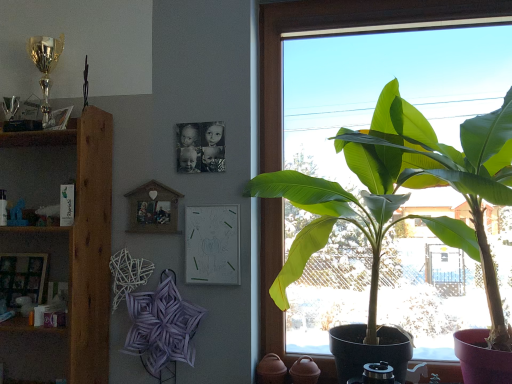
Question: From the image's perspective, is green leafy plant at right under wooden picture frame at lower left, acting as the first picture frame starting from the left?

Choices:
 (A) no
 (B) yes

Answer: (A)

Question: Does green leafy plant at right have a lesser width compared to wooden picture frame at lower left, acting as the first picture frame starting from the left?

Choices:
 (A) no
 (B) yes

Answer: (A)

Question: Can you confirm if green leafy plant at right is shorter than wooden picture frame at lower left, acting as the first picture frame starting from the left?

Choices:
 (A) no
 (B) yes

Answer: (A)

Question: Can we say green leafy plant at right lies outside wooden picture frame at lower left, the 3th picture frame from the right?

Choices:
 (A) no
 (B) yes

Answer: (B)

Question: Does green leafy plant at right appear on the left side of wooden picture frame at lower left, the 3th picture frame from the right?

Choices:
 (A) no
 (B) yes

Answer: (A)

Question: From the image's perspective, is wooden picture frame at lower left, acting as the first picture frame starting from the left, positioned above or below wooden shelf at left?

Choices:
 (A) below
 (B) above

Answer: (A)

Question: Choose the correct answer: Is wooden picture frame at lower left, acting as the first picture frame starting from the left, inside wooden shelf at left or outside it?

Choices:
 (A) outside
 (B) inside

Answer: (A)

Question: Would you say wooden picture frame at lower left, acting as the first picture frame starting from the left, is to the left or to the right of wooden shelf at left in the picture?

Choices:
 (A) right
 (B) left

Answer: (B)

Question: Considering the positions of point click(34, 284) and point click(20, 187), is point click(34, 284) closer or farther from the camera than point click(20, 187)?

Choices:
 (A) closer
 (B) farther

Answer: (A)

Question: Considering the relative positions of transparent glass window at right and wooden picture frame at lower left, the 3th picture frame from the right, in the image provided, is transparent glass window at right to the left or to the right of wooden picture frame at lower left, the 3th picture frame from the right,?

Choices:
 (A) right
 (B) left

Answer: (A)

Question: Which is correct: transparent glass window at right is inside wooden picture frame at lower left, acting as the first picture frame starting from the left, or outside of it?

Choices:
 (A) outside
 (B) inside

Answer: (A)

Question: From their relative heights in the image, would you say transparent glass window at right is taller or shorter than wooden picture frame at lower left, the 3th picture frame from the right?

Choices:
 (A) short
 (B) tall

Answer: (B)

Question: From a real-world perspective, is transparent glass window at right physically located above or below wooden picture frame at lower left, acting as the first picture frame starting from the left?

Choices:
 (A) below
 (B) above

Answer: (B)

Question: Is wooden shelf at left bigger or smaller than wooden shelf at left?

Choices:
 (A) small
 (B) big

Answer: (A)

Question: Considering the positions of point (25, 147) and point (88, 114), is point (25, 147) closer or farther from the camera than point (88, 114)?

Choices:
 (A) closer
 (B) farther

Answer: (B)